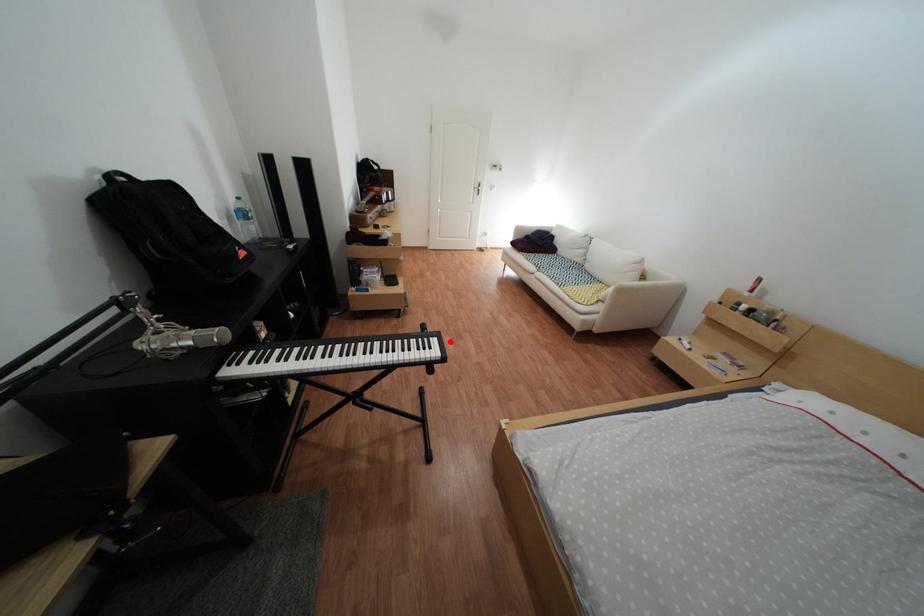
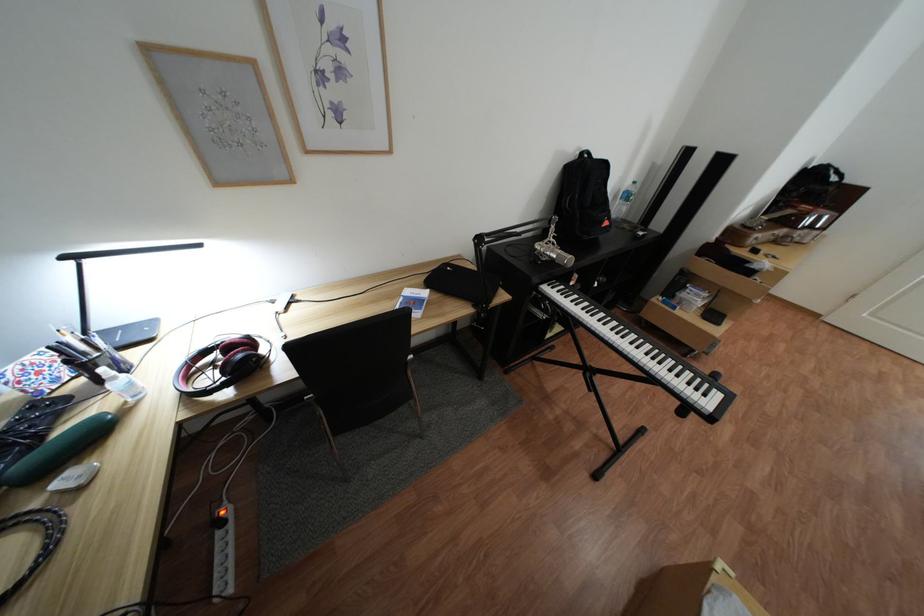
In the second image, find the point that corresponds to the highlighted location in the first image.

(734, 397)